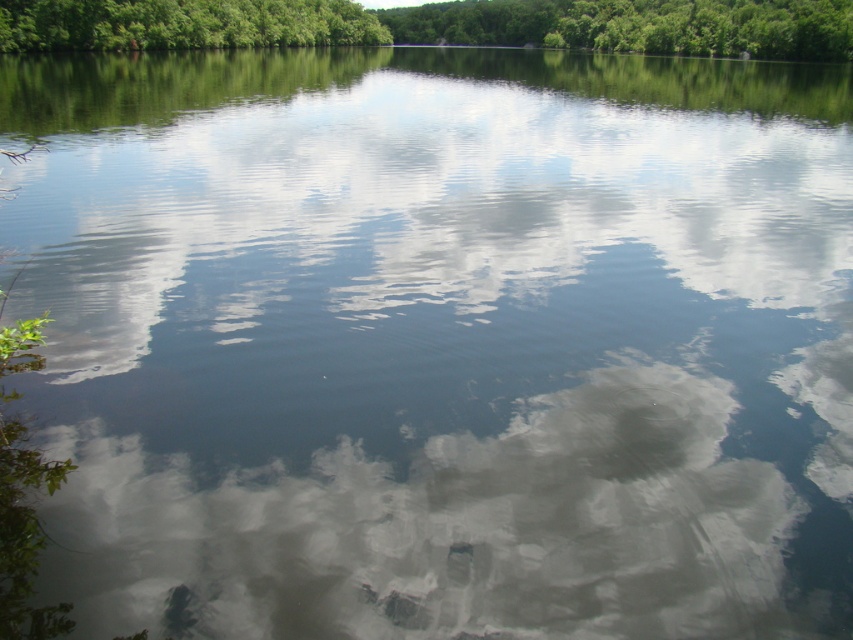
Does green leafy tree at upper center appear over green leafy trees at upper center?

Yes, green leafy tree at upper center is above green leafy trees at upper center.

In the scene shown: Does green leafy tree at upper center have a lesser width compared to green leafy trees at upper center?

Incorrect, green leafy tree at upper center's width is not less than green leafy trees at upper center's.

Does point (817, 52) come behind point (152, 10)?

Yes.

The width and height of the screenshot is (853, 640). I want to click on green leafy tree at upper center, so click(x=438, y=24).

Does cloudy sky at center have a smaller size compared to green leafy trees at upper center?

Correct, cloudy sky at center occupies less space than green leafy trees at upper center.

Which is in front, point (291, 548) or point (59, 4)?

Point (291, 548) is more forward.

Is point (682, 483) positioned in front of point (288, 13)?

Yes, point (682, 483) is closer to viewer.

At what (x,y) coordinates should I click in order to perform the action: click on cloudy sky at center. Please return your answer as a coordinate pair (x, y). The width and height of the screenshot is (853, 640). Looking at the image, I should click on (444, 529).

Is point (607, 456) closer to camera compared to point (352, 12)?

Yes, it is in front of point (352, 12).

Does cloudy sky at center appear on the right side of green leafy tree at upper center?

Incorrect, cloudy sky at center is not on the right side of green leafy tree at upper center.

Is point (206, 621) farther from viewer compared to point (38, 44)?

No, (206, 621) is in front of (38, 44).

At what (x,y) coordinates should I click in order to perform the action: click on cloudy sky at center. Please return your answer as a coordinate pair (x, y). Image resolution: width=853 pixels, height=640 pixels. Looking at the image, I should click on (444, 529).